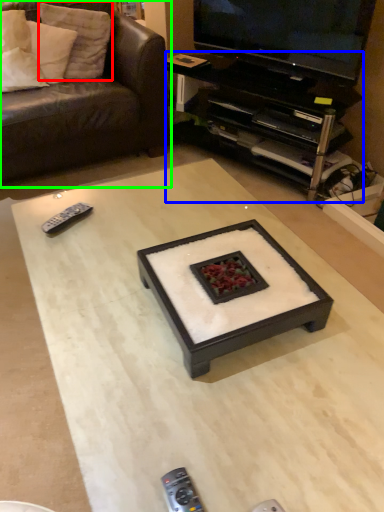
Question: Which object is the closest to the pillow (highlighted by a red box)? Choose among these: desk (highlighted by a blue box) or studio couch (highlighted by a green box).

Choices:
 (A) desk
 (B) studio couch

Answer: (B)